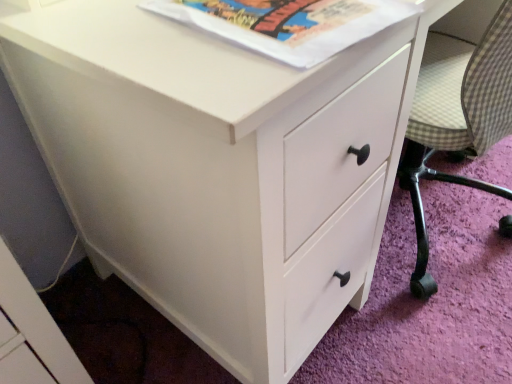
You are a GUI agent. You are given a task and a screenshot of the screen. Output one action in this format:
    pyautogui.click(x=<x>, y=<y>)
    Task: Click on the checkered fabric armchair at right
    The image size is (512, 384).
    Given the screenshot: What is the action you would take?
    pyautogui.click(x=457, y=118)

What is the approximate height of checkered fabric armchair at right?

checkered fabric armchair at right is 27.64 inches tall.

The image size is (512, 384). Describe the element at coordinates (457, 118) in the screenshot. I see `checkered fabric armchair at right` at that location.

What is the approximate width of checkered fabric armchair at right?

checkered fabric armchair at right is 19.43 inches wide.

Describe the element at coordinates (288, 23) in the screenshot. I see `white paper at upper center` at that location.

This screenshot has height=384, width=512. I want to click on white paper at upper center, so click(x=288, y=23).

At what (x,y) coordinates should I click in order to perform the action: click on checkered fabric armchair at right. Please return your answer as a coordinate pair (x, y). Looking at the image, I should click on (457, 118).

Does white paper at upper center appear on the left side of checkered fabric armchair at right?

Yes.

Is white paper at upper center positioned before checkered fabric armchair at right?

Yes, white paper at upper center is in front of checkered fabric armchair at right.

Considering the points (222, 4) and (420, 201), which point is in front, point (222, 4) or point (420, 201)?

The point (222, 4) is more forward.

From the image's perspective, which is below, white paper at upper center or checkered fabric armchair at right?

checkered fabric armchair at right.

From a real-world perspective, is white paper at upper center physically below checkered fabric armchair at right?

No, from a real-world perspective, white paper at upper center is not beneath checkered fabric armchair at right.

Considering the sizes of white paper at upper center and checkered fabric armchair at right in the image, is white paper at upper center wider or thinner than checkered fabric armchair at right?

white paper at upper center is thinner than checkered fabric armchair at right.

Consider the image. Which of these two, white paper at upper center or checkered fabric armchair at right, stands taller?

checkered fabric armchair at right.

Is white paper at upper center smaller than checkered fabric armchair at right?

Yes, white paper at upper center is smaller than checkered fabric armchair at right.

In the scene shown: Choose the correct answer: Is white paper at upper center inside checkered fabric armchair at right or outside it?

white paper at upper center exists outside the volume of checkered fabric armchair at right.

Would you consider white paper at upper center to be distant from checkered fabric armchair at right?

No, white paper at upper center is not far away from checkered fabric armchair at right.

In the scene shown: Does white paper at upper center turn towards checkered fabric armchair at right?

No, white paper at upper center is not facing towards checkered fabric armchair at right.

Can you tell me how much white paper at upper center and checkered fabric armchair at right differ in facing direction?

white paper at upper center and checkered fabric armchair at right are facing 161 degrees away from each other.

In order to click on armchair that is behind the white paper at upper center in this screenshot , I will do `click(457, 118)`.

Is checkered fabric armchair at right to the left or to the right of white paper at upper center in the image?

checkered fabric armchair at right is positioned on white paper at upper center's right side.

Considering their positions, is checkered fabric armchair at right located in front of or behind white paper at upper center?

checkered fabric armchair at right is behind white paper at upper center.

Does point (470, 117) come behind point (383, 17)?

Yes, point (470, 117) is behind point (383, 17).

From the image's perspective, is checkered fabric armchair at right on top of white paper at upper center?

No, from the image's perspective, checkered fabric armchair at right is not above white paper at upper center.

From a real-world perspective, is checkered fabric armchair at right physically below white paper at upper center?

Indeed, from a real-world perspective, checkered fabric armchair at right is positioned beneath white paper at upper center.

Looking at this image, considering the relative sizes of checkered fabric armchair at right and white paper at upper center in the image provided, is checkered fabric armchair at right thinner than white paper at upper center?

No, checkered fabric armchair at right is not thinner than white paper at upper center.

Who is taller, checkered fabric armchair at right or white paper at upper center?

Standing taller between the two is checkered fabric armchair at right.

Based on the photo, considering the sizes of objects checkered fabric armchair at right and white paper at upper center in the image provided, who is bigger, checkered fabric armchair at right or white paper at upper center?

checkered fabric armchair at right.

Would you say white paper at upper center is part of checkered fabric armchair at right's contents?

No, white paper at upper center is located outside of checkered fabric armchair at right.

Is there a large distance between checkered fabric armchair at right and white paper at upper center?

checkered fabric armchair at right is near white paper at upper center, not far away.

Based on the photo, is white paper at upper center at the back of checkered fabric armchair at right?

No, white paper at upper center is not at the back of checkered fabric armchair at right.

Can you tell me how much checkered fabric armchair at right and white paper at upper center differ in facing direction?

They differ by 161 degrees in their facing directions.

Identify the location of paperback book that appears above the checkered fabric armchair at right (from the image's perspective). (288, 23).

Find the location of a particular element. paperback book lying on the left of checkered fabric armchair at right is located at coordinates (288, 23).

In order to click on armchair below the white paper at upper center (from the image's perspective) in this screenshot , I will do `click(457, 118)`.